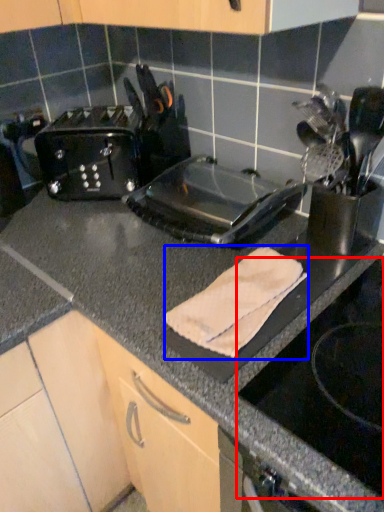
Question: Which point is further to the camera, gas stove (highlighted by a red box) or bath towel (highlighted by a blue box)?

Choices:
 (A) gas stove
 (B) bath towel

Answer: (B)